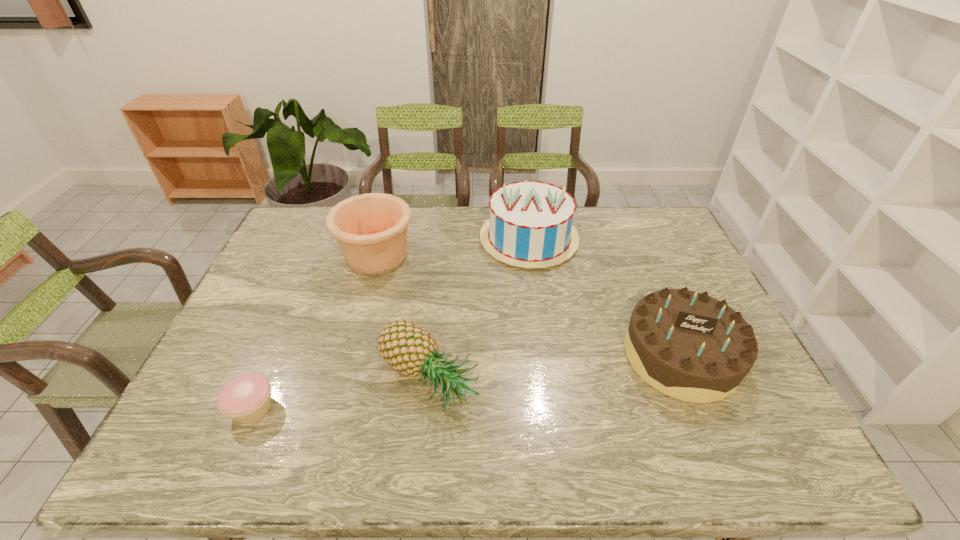
You are a GUI agent. You are given a task and a screenshot of the screen. Output one action in this format:
    pyautogui.click(x=<x>, y=<y>)
    Task: Click on the vacant space located on the left of the pineapple
    
    Given the screenshot: What is the action you would take?
    pyautogui.click(x=237, y=381)

At what (x,y) coordinates should I click in order to perform the action: click on vacant region located on the back of the cupcake. Please return your answer as a coordinate pair (x, y). Looking at the image, I should click on (279, 346).

At what (x,y) coordinates should I click in order to perform the action: click on birthday cake that is at the far edge. Please return your answer as a coordinate pair (x, y). This screenshot has height=540, width=960. Looking at the image, I should click on (530, 223).

Locate an element on the screen. Image resolution: width=960 pixels, height=540 pixels. pottery at the far edge is located at coordinates (371, 229).

You are a GUI agent. You are given a task and a screenshot of the screen. Output one action in this format:
    pyautogui.click(x=<x>, y=<y>)
    Task: Click on the object present at the left edge
    
    Given the screenshot: What is the action you would take?
    pyautogui.click(x=246, y=398)

This screenshot has width=960, height=540. In order to click on object that is positioned at the right edge in this screenshot , I will do `click(687, 345)`.

Image resolution: width=960 pixels, height=540 pixels. In the image, there is a desktop. Identify the location of blank space at the far edge. (587, 231).

Find the location of a particular element. This screenshot has width=960, height=540. vacant region at the near edge of the desktop is located at coordinates (351, 442).

The image size is (960, 540). Identify the location of vacant space at the left edge. (279, 304).

Locate an element on the screen. This screenshot has width=960, height=540. vacant area at the far left corner is located at coordinates (314, 230).